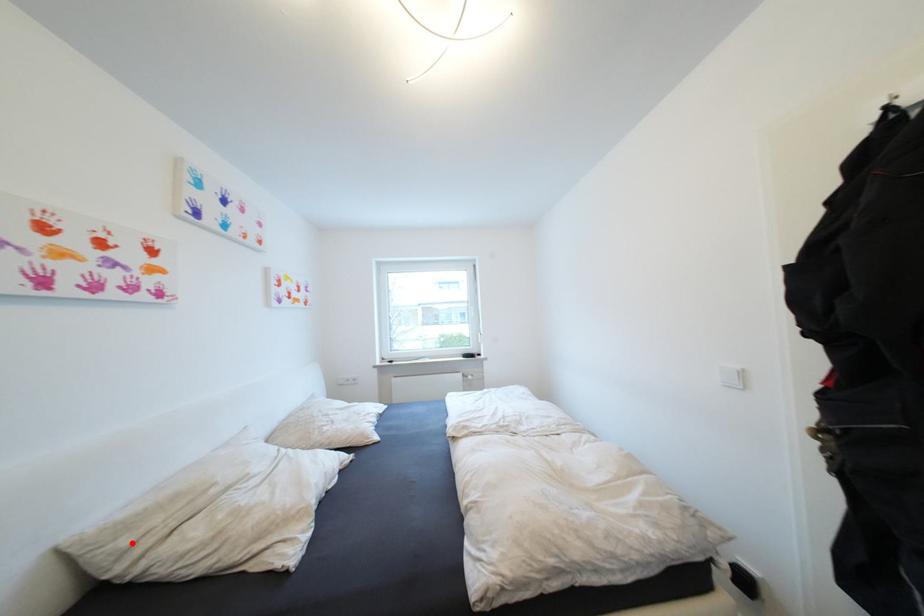
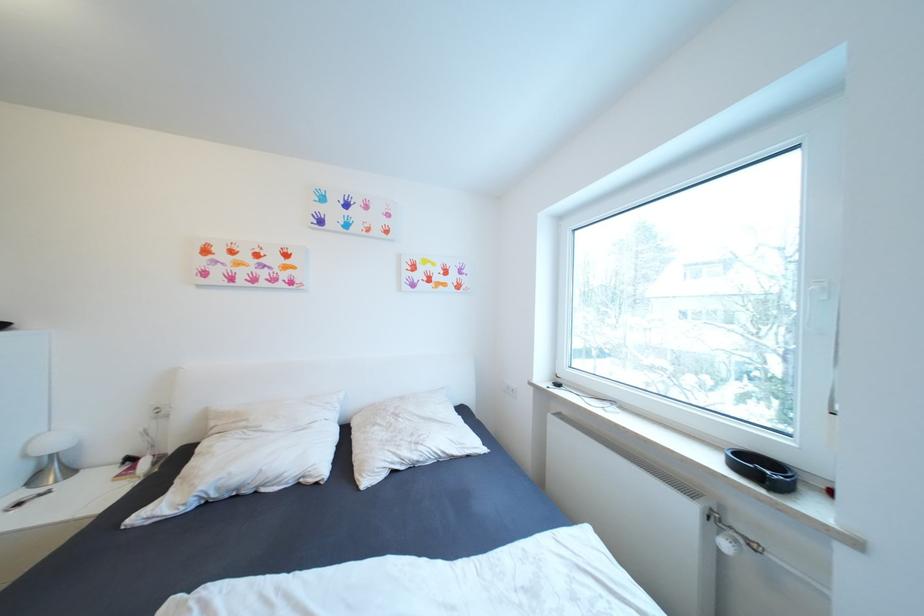
Question: I am providing you with two images of the same scene from different viewpoints. Image1 has a red point marked. In image2, the corresponding 3D location appears at what relative position? Reply with the corresponding letter.

Choices:
 (A) Closer
 (B) Farther

Answer: (B)